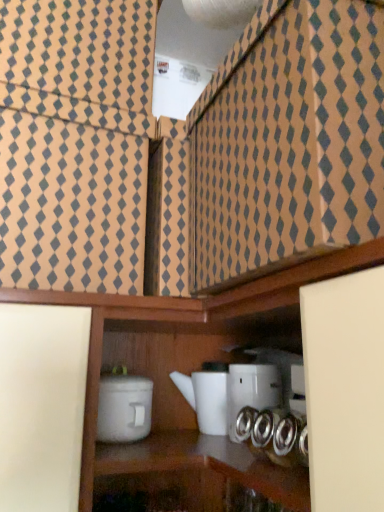
Question: Is white glossy teapot at center, the second appliance when ordered from left to right, far from white matte container at lower center, arranged as the 1th appliance when viewed from the left?

Choices:
 (A) yes
 (B) no

Answer: (B)

Question: Is white glossy teapot at center, the second appliance when ordered from left to right, thinner than white matte container at lower center, arranged as the 1th appliance when viewed from the left?

Choices:
 (A) no
 (B) yes

Answer: (A)

Question: Is white glossy teapot at center, which is the 2th appliance from right to left, oriented towards white matte container at lower center, which is counted as the third appliance, starting from the right?

Choices:
 (A) yes
 (B) no

Answer: (B)

Question: From the image's perspective, is white glossy teapot at center, the second appliance when ordered from left to right, beneath white matte container at lower center, which is counted as the third appliance, starting from the right?

Choices:
 (A) yes
 (B) no

Answer: (A)

Question: Considering the relative positions of white glossy teapot at center, which is the 2th appliance from right to left, and white matte container at lower center, arranged as the 1th appliance when viewed from the left, in the image provided, is white glossy teapot at center, which is the 2th appliance from right to left, to the right of white matte container at lower center, arranged as the 1th appliance when viewed from the left, from the viewer's perspective?

Choices:
 (A) no
 (B) yes

Answer: (B)

Question: In terms of height, does white glossy teapot at center, the 3th appliance from the left, look taller or shorter compared to white glossy teapot at center, the second appliance when ordered from left to right?

Choices:
 (A) tall
 (B) short

Answer: (A)

Question: From a real-world perspective, relative to white glossy teapot at center, the second appliance when ordered from left to right, is white glossy teapot at center, which ranks as the 1th appliance in right-to-left order, vertically above or below?

Choices:
 (A) above
 (B) below

Answer: (A)

Question: Considering the relative positions of white glossy teapot at center, the 3th appliance from the left, and white glossy teapot at center, which is the 2th appliance from right to left, in the image provided, is white glossy teapot at center, the 3th appliance from the left, to the left or to the right of white glossy teapot at center, which is the 2th appliance from right to left,?

Choices:
 (A) left
 (B) right

Answer: (B)

Question: Based on their sizes in the image, would you say white glossy teapot at center, which ranks as the 1th appliance in right-to-left order, is bigger or smaller than white glossy teapot at center, which is the 2th appliance from right to left?

Choices:
 (A) big
 (B) small

Answer: (B)

Question: In terms of size, does white glossy teapot at center, the second appliance when ordered from left to right, appear bigger or smaller than white matte container at lower center, arranged as the 1th appliance when viewed from the left?

Choices:
 (A) small
 (B) big

Answer: (B)

Question: From the image's perspective, is white glossy teapot at center, the second appliance when ordered from left to right, positioned above or below white matte container at lower center, which is counted as the third appliance, starting from the right?

Choices:
 (A) above
 (B) below

Answer: (B)

Question: Considering the positions of white glossy teapot at center, which is the 2th appliance from right to left, and white matte container at lower center, arranged as the 1th appliance when viewed from the left, in the image, is white glossy teapot at center, which is the 2th appliance from right to left, taller or shorter than white matte container at lower center, arranged as the 1th appliance when viewed from the left,?

Choices:
 (A) tall
 (B) short

Answer: (A)

Question: Considering the positions of white glossy teapot at center, which is the 2th appliance from right to left, and white matte container at lower center, which is counted as the third appliance, starting from the right, in the image, is white glossy teapot at center, which is the 2th appliance from right to left, wider or thinner than white matte container at lower center, which is counted as the third appliance, starting from the right,?

Choices:
 (A) wide
 (B) thin

Answer: (A)

Question: Is white matte container at lower center, which is counted as the third appliance, starting from the right, bigger or smaller than white glossy teapot at center, the second appliance when ordered from left to right?

Choices:
 (A) big
 (B) small

Answer: (B)

Question: Visually, is white matte container at lower center, arranged as the 1th appliance when viewed from the left, positioned to the left or to the right of white glossy teapot at center, which is the 2th appliance from right to left?

Choices:
 (A) right
 (B) left

Answer: (B)